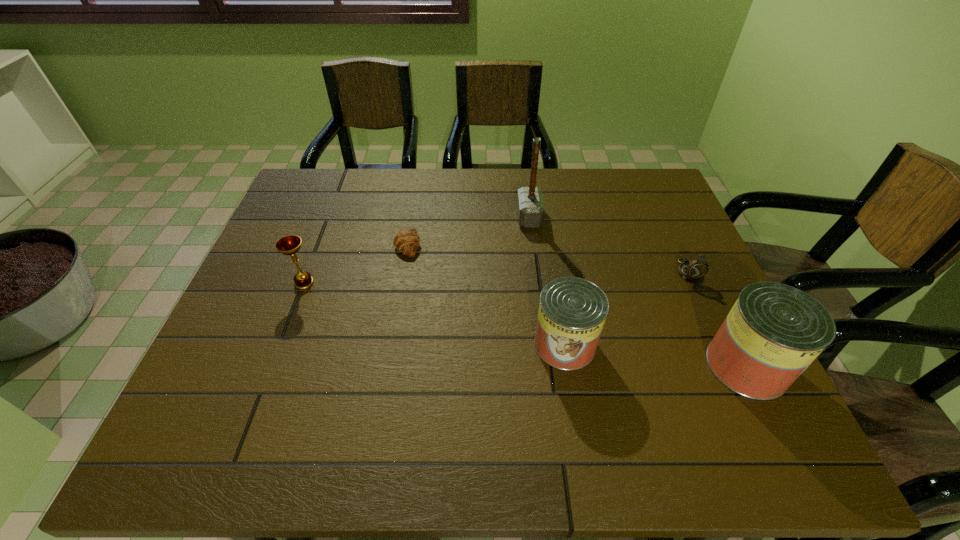
Where is `empty space that is in between the compass and the second tallest object`? The width and height of the screenshot is (960, 540). empty space that is in between the compass and the second tallest object is located at coordinates (717, 318).

Identify the location of vacant space in between the shortest object and the chalice. The image size is (960, 540). (356, 264).

The width and height of the screenshot is (960, 540). In order to click on free space between the leftmost object and the fifth object from right to left in this screenshot , I will do `click(356, 264)`.

Where is `blank region between the tallest object and the right can`? The width and height of the screenshot is (960, 540). blank region between the tallest object and the right can is located at coordinates (638, 291).

Identify the location of unoccupied area between the fifth shortest object and the chalice. The height and width of the screenshot is (540, 960). (525, 324).

At what (x,y) coordinates should I click in order to perform the action: click on free space between the crescent roll and the chalice. Please return your answer as a coordinate pair (x, y). This screenshot has height=540, width=960. Looking at the image, I should click on (356, 264).

Find the location of a particular element. Image resolution: width=960 pixels, height=540 pixels. object that stands as the fifth closest to the fifth object from right to left is located at coordinates (774, 331).

Choose which object is the fourth nearest neighbor to the left can. Please provide its 2D coordinates. Your answer should be formatted as a tuple, i.e. [(x, y)], where the tuple contains the x and y coordinates of a point satisfying the conditions above.

[(406, 241)]

Where is `free space that satisfies the following two spatial constraints: 1. on the striking surface of the taller can; 2. on the left side of the hammer`? free space that satisfies the following two spatial constraints: 1. on the striking surface of the taller can; 2. on the left side of the hammer is located at coordinates (548, 366).

Image resolution: width=960 pixels, height=540 pixels. In order to click on vacant space that satisfies the following two spatial constraints: 1. on the striking surface of the hammer; 2. on the back side of the left can in this screenshot , I will do point(545,345).